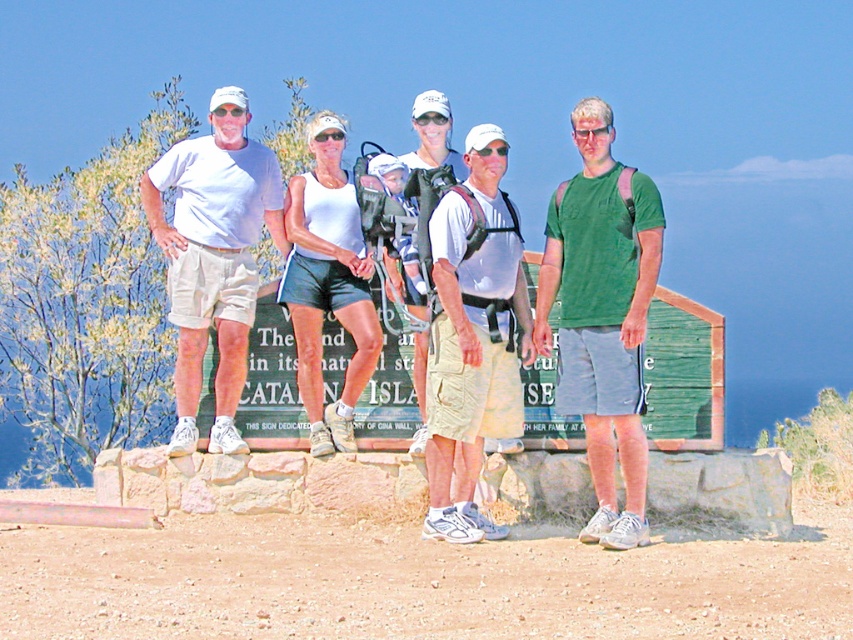
Question: Does light brown canvas shorts at center lie in front of khaki cotton shorts at center?

Choices:
 (A) no
 (B) yes

Answer: (B)

Question: Is light brown canvas shorts at center bigger than khaki cotton shorts at center?

Choices:
 (A) yes
 (B) no

Answer: (B)

Question: Which point appears closest to the camera in this image?

Choices:
 (A) (488, 435)
 (B) (415, 305)
 (C) (241, 120)
 (D) (596, 232)

Answer: (D)

Question: From the image, what is the correct spatial relationship of light brown canvas shorts at center in relation to khaki cotton shorts at center?

Choices:
 (A) right
 (B) left

Answer: (A)

Question: Which point is farther to the camera?

Choices:
 (A) (485, 525)
 (B) (646, 266)
 (C) (444, 163)
 (D) (225, 397)

Answer: (C)

Question: Which of the following is the closest to the observer?

Choices:
 (A) (432, 513)
 (B) (419, 401)

Answer: (A)